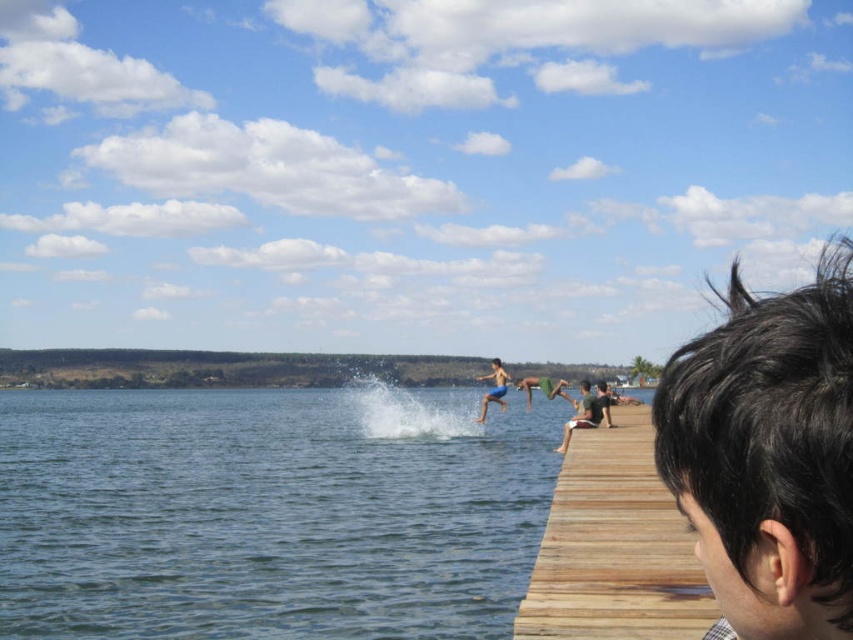
You are a photographer planning to take a wide shot of the wooden dock at right and the smooth skin child at center. Given that your camera can only capture objects within a 3 meter width, will both fit in the frame?

The wooden dock at right is wider than the smooth skin child at center. Since the camera can capture up to 3 meters, but the exact widths aren

You are standing on the wooden dock at right and want to see the smooth skin child at center. Which direction should you look to see them?

Since the wooden dock at right is in front of the smooth skin child at center, you should look behind the wooden dock at right to see the smooth skin child at center.